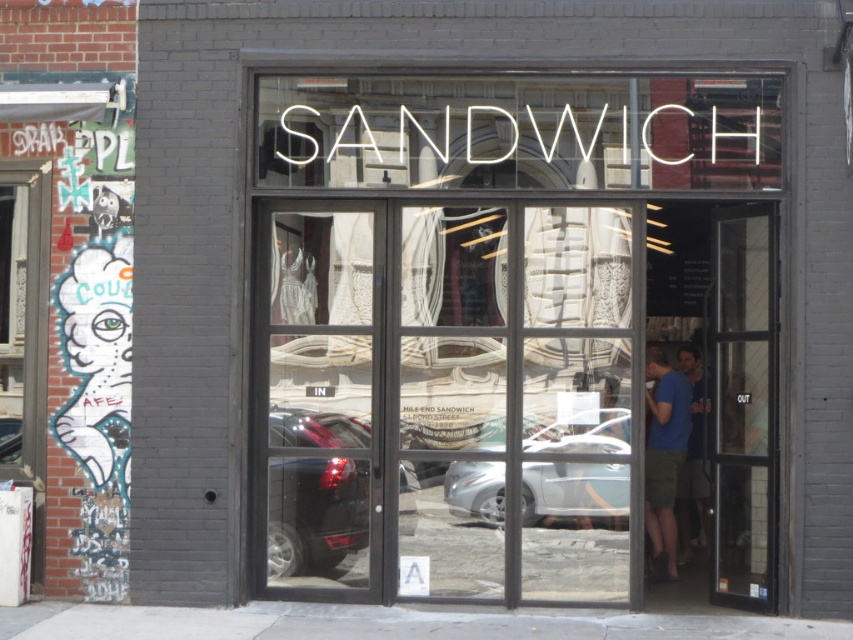
You are standing outside the sandwich shop and want to enter through the transparent glass door at right. According to the coordinates given, is the point at (x=741, y=404) on the transparent glass door at right?

Yes, the point at (x=741, y=404) is on the transparent glass door at right.

You are a delivery person holding a blue cotton shirt at center and need to enter the sandwich shop through the transparent glass door at right. Can you pass through the door without bending down?

The transparent glass door at right has a larger size compared to blue cotton shirt at center, so yes, you can pass through the door without bending down.